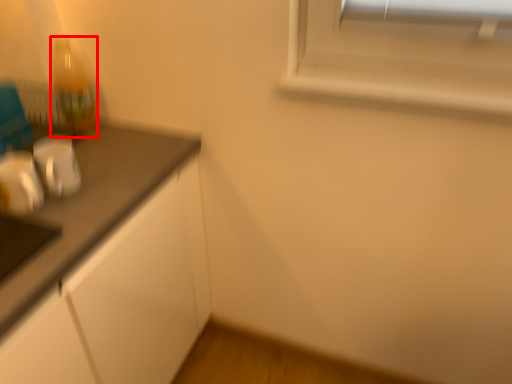
Question: From the image, what is the correct spatial relationship of bottle (annotated by the red box) in relation to appliance?

Choices:
 (A) right
 (B) left

Answer: (B)